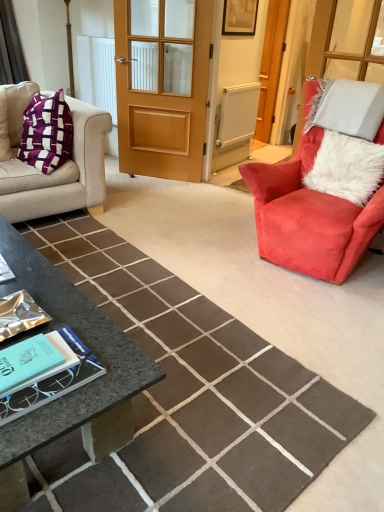
You are a GUI agent. You are given a task and a screenshot of the screen. Output one action in this format:
    pyautogui.click(x=<x>, y=<y>)
    Task: Click on the free area in between velvet beige couch at left and velvet red armchair at right
    The image size is (384, 512).
    Given the screenshot: What is the action you would take?
    pyautogui.click(x=162, y=231)